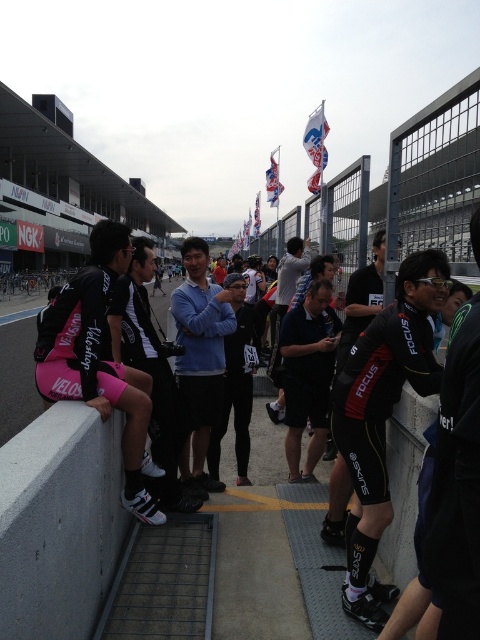
You are a photographer at the event and need to frame a shot that includes both the black matte cycling suit at center and the pink fabric shorts at left. Based on their sizes, which object should you prioritize positioning closer to the edge of the frame to ensure both fit well?

The black matte cycling suit at center occupies less space than the pink fabric shorts at left, so you should prioritize positioning the pink fabric shorts at left closer to the edge of the frame to ensure both fit well.

In the scene shown: You are a photographer at the event and need to capture a wide shot of the black matte cycling suit at center and pink fabric shorts at left. Which clothing item will appear narrower in the photo?

The black matte cycling suit at center will appear narrower in the photo because it has a lesser width compared to the pink fabric shorts at left.